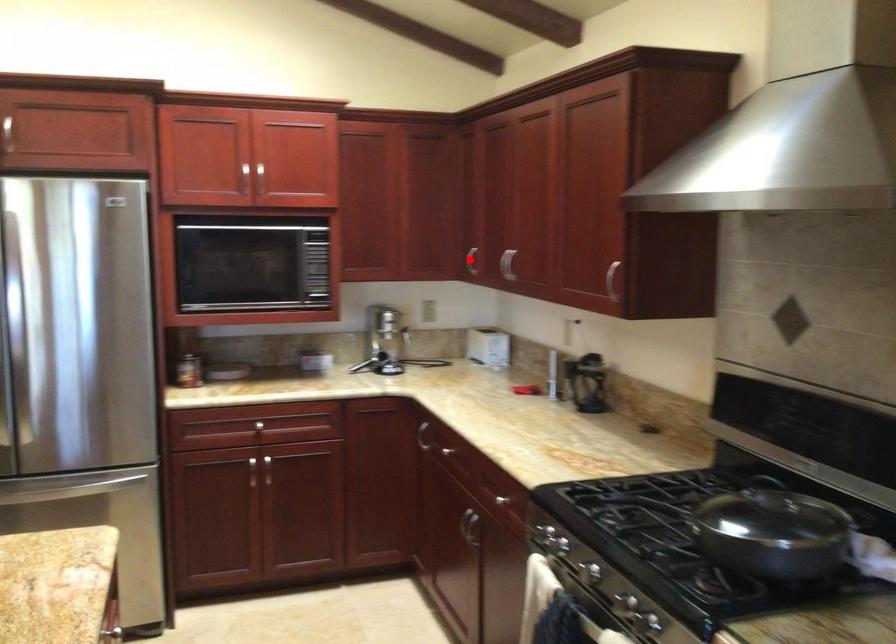
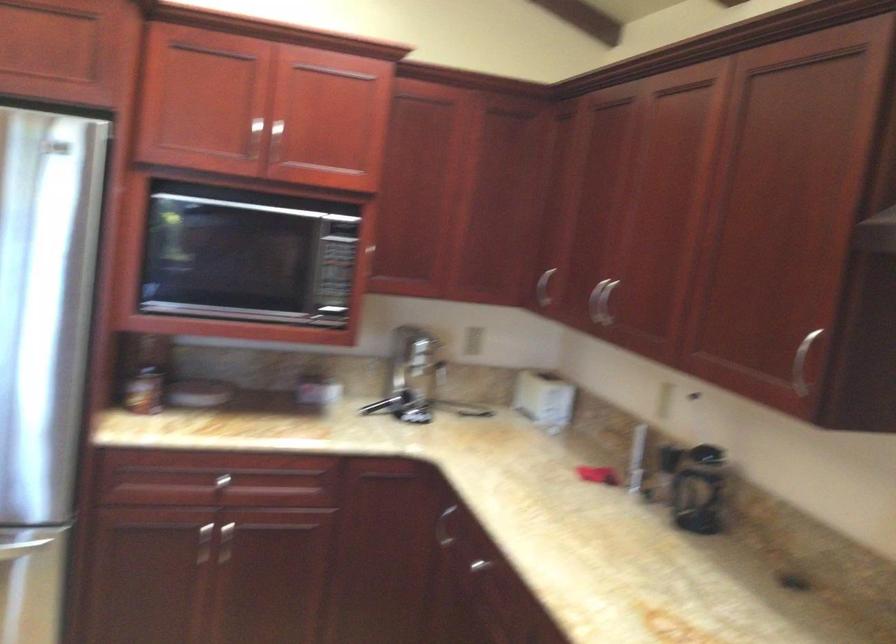
Locate, in the second image, the point that corresponds to the highlighted location in the first image.

(544, 287)